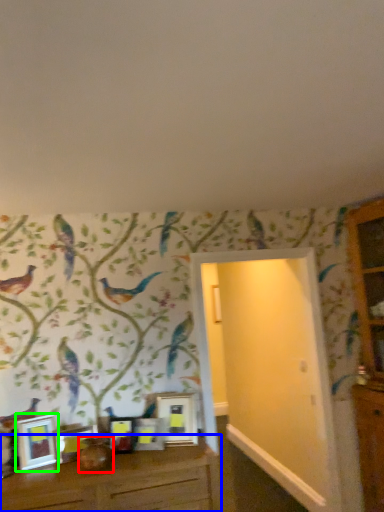
Question: Estimate the real-world distances between objects in this image. Which object is closer to vase (highlighted by a red box), table (highlighted by a blue box) or picture frame (highlighted by a green box)?

Choices:
 (A) table
 (B) picture frame

Answer: (A)